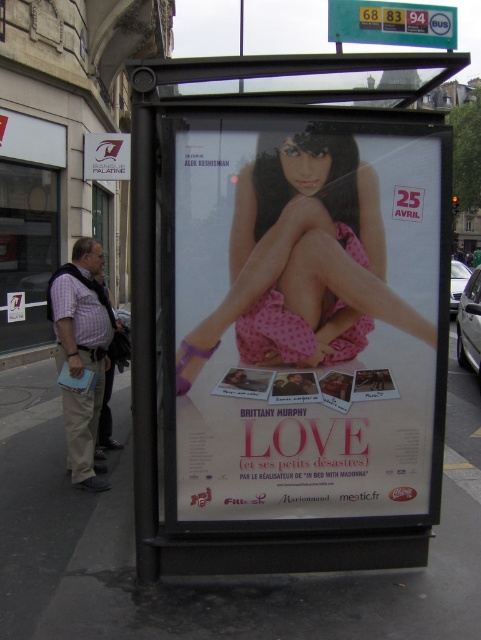
Question: Among these points, which one is farthest from the camera?

Choices:
 (A) (406, 12)
 (B) (3, 609)

Answer: (A)

Question: Which object is the closest to the yellow/gold plastic bus stop sign at upper center?

Choices:
 (A) pink polka dot dress at center
 (B) metallic silver sign at upper left

Answer: (A)

Question: Can you confirm if plaid shirt at left is positioned to the right of metallic silver sign at upper left?

Choices:
 (A) no
 (B) yes

Answer: (B)

Question: Where is pink polka dot dress at center located in relation to yellow/gold plastic bus stop sign at upper center in the image?

Choices:
 (A) below
 (B) above

Answer: (A)

Question: Which point is closer to the camera taking this photo?

Choices:
 (A) (229, 268)
 (B) (88, 168)
 (C) (281, 406)

Answer: (A)

Question: Is pink polka dot dress at center above yellow/gold plastic bus stop sign at upper center?

Choices:
 (A) yes
 (B) no

Answer: (B)